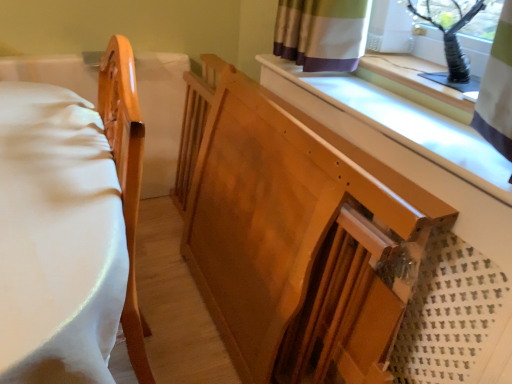
The image size is (512, 384). What do you see at coordinates (457, 33) in the screenshot?
I see `black plastic vase at upper right` at bounding box center [457, 33].

You are a GUI agent. You are given a task and a screenshot of the screen. Output one action in this format:
    pyautogui.click(x=<x>, y=<y>)
    Task: Click on the matte wood bed frame at left
    
    Given the screenshot: What is the action you would take?
    pyautogui.click(x=126, y=177)

At what (x,y) coordinates should I click in order to perform the action: click on black plastic vase at upper right. Please return your answer as a coordinate pair (x, y). Image resolution: width=512 pixels, height=384 pixels. Looking at the image, I should click on point(457,33).

Identify the location of window screen above the matte wood bed frame at left (from the image's perspective). (457, 33).

From the image's perspective, does black plastic vase at upper right appear lower than matte wood bed frame at left?

Actually, black plastic vase at upper right appears above matte wood bed frame at left in the image.

Considering the relative sizes of black plastic vase at upper right and matte wood bed frame at left in the image provided, is black plastic vase at upper right shorter than matte wood bed frame at left?

Yes.

Does matte wood bed frame at left come behind wooden changing table at center?

No, matte wood bed frame at left is closer to the camera.

Which is closer, (x=113, y=153) or (x=248, y=350)?

Point (x=113, y=153)

From a real-world perspective, is matte wood bed frame at left physically located above or below wooden changing table at center?

From a real-world perspective, matte wood bed frame at left is physically above wooden changing table at center.

Which is more to the left, matte wood bed frame at left or wooden changing table at center?

From the viewer's perspective, matte wood bed frame at left appears more on the left side.

Who is bigger, matte wood bed frame at left or black plastic vase at upper right?

Bigger between the two is matte wood bed frame at left.

From the image's perspective, is matte wood bed frame at left over black plastic vase at upper right?

Actually, matte wood bed frame at left appears below black plastic vase at upper right in the image.

Considering the relative sizes of matte wood bed frame at left and black plastic vase at upper right in the image provided, is matte wood bed frame at left wider than black plastic vase at upper right?

Indeed, matte wood bed frame at left has a greater width compared to black plastic vase at upper right.

Looking at this image, is matte wood bed frame at left not near black plastic vase at upper right?

That's not correct — matte wood bed frame at left is a little close to black plastic vase at upper right.

Looking at this image, from a real-world perspective, does wooden changing table at center sit lower than black plastic vase at upper right?

Yes, from a real-world perspective, wooden changing table at center is beneath black plastic vase at upper right.

Which object is further away from the camera taking this photo, wooden changing table at center or black plastic vase at upper right?

black plastic vase at upper right is further away from the camera.

Is wooden changing table at center wider than black plastic vase at upper right?

Indeed, wooden changing table at center has a greater width compared to black plastic vase at upper right.

Is point (224, 75) more distant than point (472, 38)?

Yes.

Find the location of a particular element. changing table below the matte wood bed frame at left (from a real-world perspective) is located at coordinates (291, 225).

From the image's perspective, is wooden changing table at center located above or below matte wood bed frame at left?

From the image's perspective, wooden changing table at center appears above matte wood bed frame at left.

Consider the image. Who is taller, wooden changing table at center or matte wood bed frame at left?

Standing taller between the two is matte wood bed frame at left.

Considering the positions of objects wooden changing table at center and matte wood bed frame at left in the image provided, who is more to the right, wooden changing table at center or matte wood bed frame at left?

From the viewer's perspective, wooden changing table at center appears more on the right side.

In the scene shown: Is black plastic vase at upper right facing away from wooden changing table at center?

black plastic vase at upper right is not turned away from wooden changing table at center.

In the scene shown: Between black plastic vase at upper right and wooden changing table at center, which one has more height?

Standing taller between the two is wooden changing table at center.

Is black plastic vase at upper right far away from wooden changing table at center?

Actually, black plastic vase at upper right and wooden changing table at center are a little close together.

Which of these two, black plastic vase at upper right or wooden changing table at center, is smaller?

With smaller size is black plastic vase at upper right.

Find the location of a particular element. Image resolution: width=512 pixels, height=384 pixels. furniture below the black plastic vase at upper right (from the image's perspective) is located at coordinates (126, 177).

What are the coordinates of `changing table behind the matte wood bed frame at left` in the screenshot? It's located at (291, 225).

Considering their positions, is wooden changing table at center positioned closer to matte wood bed frame at left than black plastic vase at upper right?

wooden changing table at center lies closer to matte wood bed frame at left than the other object.

Which object lies nearer to the anchor point wooden changing table at center, matte wood bed frame at left or black plastic vase at upper right?

matte wood bed frame at left lies closer to wooden changing table at center than the other object.

Looking at the image, which one is located further to wooden changing table at center, black plastic vase at upper right or matte wood bed frame at left?

black plastic vase at upper right.

Based on the photo, when comparing their distances from matte wood bed frame at left, does black plastic vase at upper right or wooden changing table at center seem further?

black plastic vase at upper right is positioned further to the anchor matte wood bed frame at left.

From the image, which object appears to be farther from black plastic vase at upper right, matte wood bed frame at left or wooden changing table at center?

Based on the image, matte wood bed frame at left appears to be further to black plastic vase at upper right.

Based on their spatial positions, is wooden changing table at center or matte wood bed frame at left further from black plastic vase at upper right?

matte wood bed frame at left is positioned further to the anchor black plastic vase at upper right.

Where is `changing table situated between matte wood bed frame at left and black plastic vase at upper right from left to right`? Image resolution: width=512 pixels, height=384 pixels. changing table situated between matte wood bed frame at left and black plastic vase at upper right from left to right is located at coordinates (291, 225).